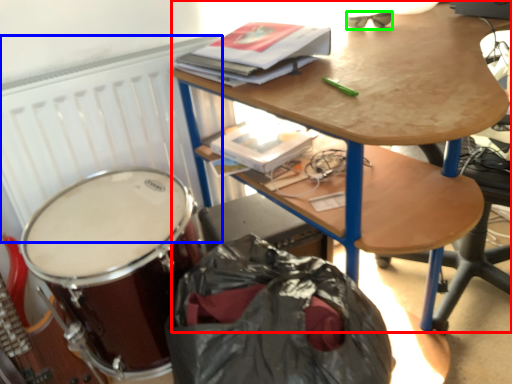
Question: Considering the real-world distances, which object is farthest from desk (highlighted by a red box)? radiator (highlighted by a blue box) or glasses (highlighted by a green box)?

Choices:
 (A) radiator
 (B) glasses

Answer: (B)